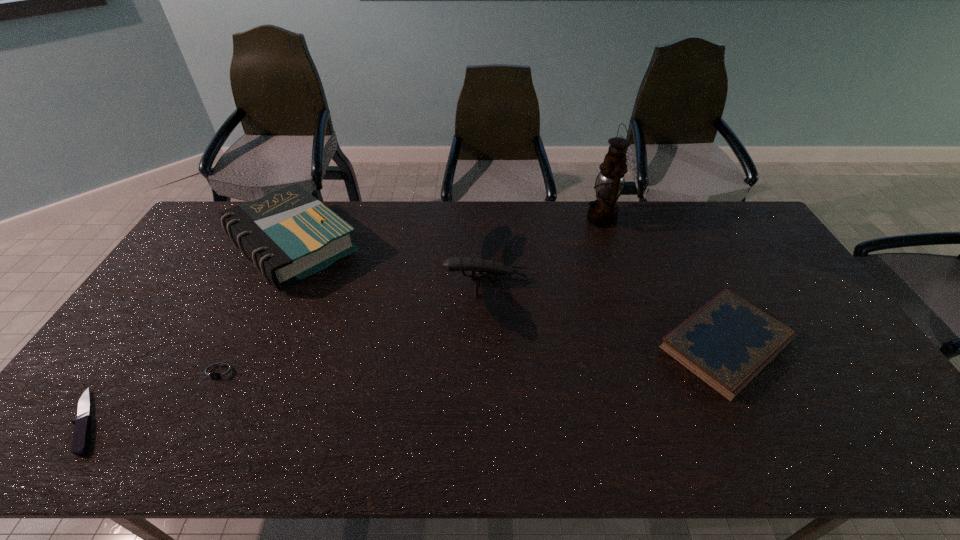
You are a GUI agent. You are given a task and a screenshot of the screen. Output one action in this format:
    pyautogui.click(x=<x>, y=<y>)
    Task: Click on the free space at the right edge of the desktop
    This screenshot has height=540, width=960.
    Given the screenshot: What is the action you would take?
    pyautogui.click(x=819, y=401)

The image size is (960, 540). I want to click on free spot at the near right corner of the desktop, so click(894, 431).

The width and height of the screenshot is (960, 540). In order to click on vacant region between the oil lamp and the taller paperback book in this screenshot , I will do `click(447, 233)`.

Find the location of a particular element. The height and width of the screenshot is (540, 960). vacant space that is in between the oil lamp and the second shortest object is located at coordinates (412, 295).

You are a GUI agent. You are given a task and a screenshot of the screen. Output one action in this format:
    pyautogui.click(x=<x>, y=<y>)
    Task: Click on the free spot between the taller paperback book and the fifth tallest object
    Image resolution: width=960 pixels, height=540 pixels.
    Given the screenshot: What is the action you would take?
    pyautogui.click(x=257, y=309)

You are a GUI agent. You are given a task and a screenshot of the screen. Output one action in this format:
    pyautogui.click(x=<x>, y=<y>)
    Task: Click on the empty space between the shortest object and the second shortest object
    The image size is (960, 540).
    Given the screenshot: What is the action you would take?
    pyautogui.click(x=155, y=396)

This screenshot has width=960, height=540. Find the location of `free space between the tallest object and the shortest object`. free space between the tallest object and the shortest object is located at coordinates (345, 320).

You are a GUI agent. You are given a task and a screenshot of the screen. Output one action in this format:
    pyautogui.click(x=<x>, y=<y>)
    Task: Click on the free space between the oil lamp and the taller paperback book
    The image size is (960, 540).
    Given the screenshot: What is the action you would take?
    pyautogui.click(x=447, y=233)

Where is `free spot between the drone and the shorter paperback book`? The height and width of the screenshot is (540, 960). free spot between the drone and the shorter paperback book is located at coordinates (606, 312).

Locate an element on the screen. vacant space that is in between the second shortest object and the shortest object is located at coordinates (155, 396).